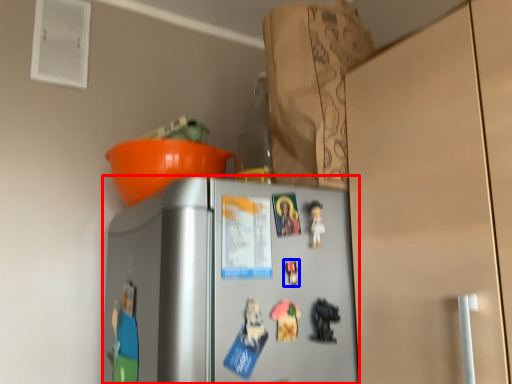
Question: Which point is further to the camera, refrigerator (highlighted by a red box) or toy (highlighted by a blue box)?

Choices:
 (A) refrigerator
 (B) toy

Answer: (B)